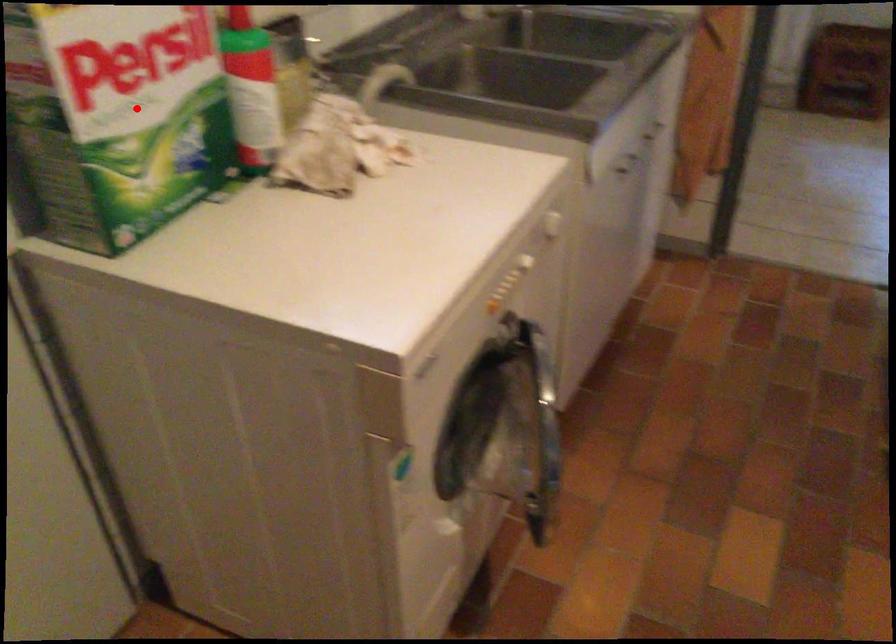
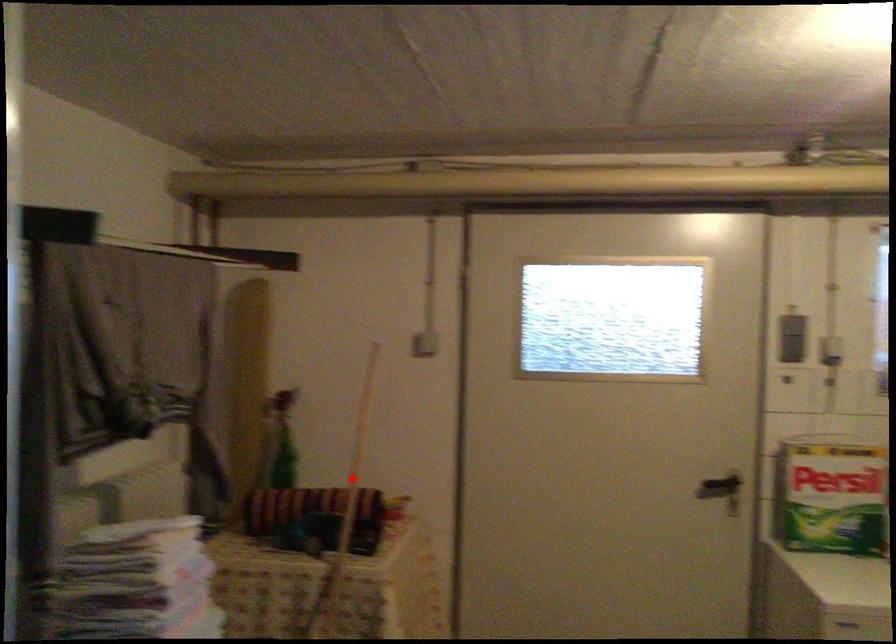
I am providing you with two images of the same scene from different viewpoints. A red point is marked on the first image and another point is marked on the second image. Is the red point in image1 aligned with the point shown in image2?

No